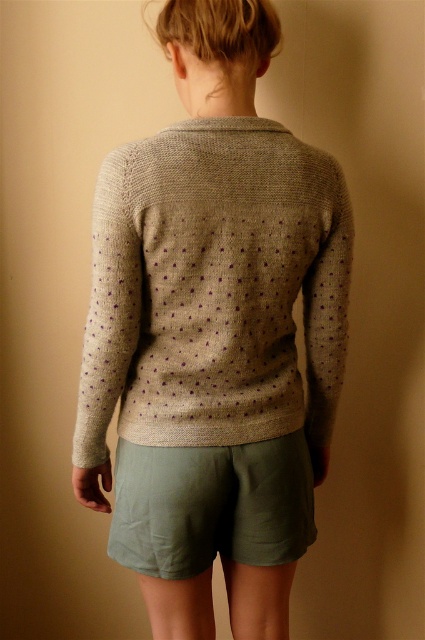
Question: Which point is closer to the camera?

Choices:
 (A) (187, 465)
 (B) (232, 428)

Answer: (A)

Question: Which of the following is the closest to the observer?

Choices:
 (A) (152, 186)
 (B) (311, 516)

Answer: (A)

Question: Does knitted beige cardigan at center lie in front of olive green cotton shorts at lower center?

Choices:
 (A) yes
 (B) no

Answer: (A)

Question: Can you confirm if knitted beige cardigan at center is bigger than olive green cotton shorts at lower center?

Choices:
 (A) yes
 (B) no

Answer: (A)

Question: Does knitted beige cardigan at center have a greater width compared to olive green cotton shorts at lower center?

Choices:
 (A) yes
 (B) no

Answer: (A)

Question: Which point is closer to the camera?

Choices:
 (A) knitted beige cardigan at center
 (B) olive green cotton shorts at lower center

Answer: (A)